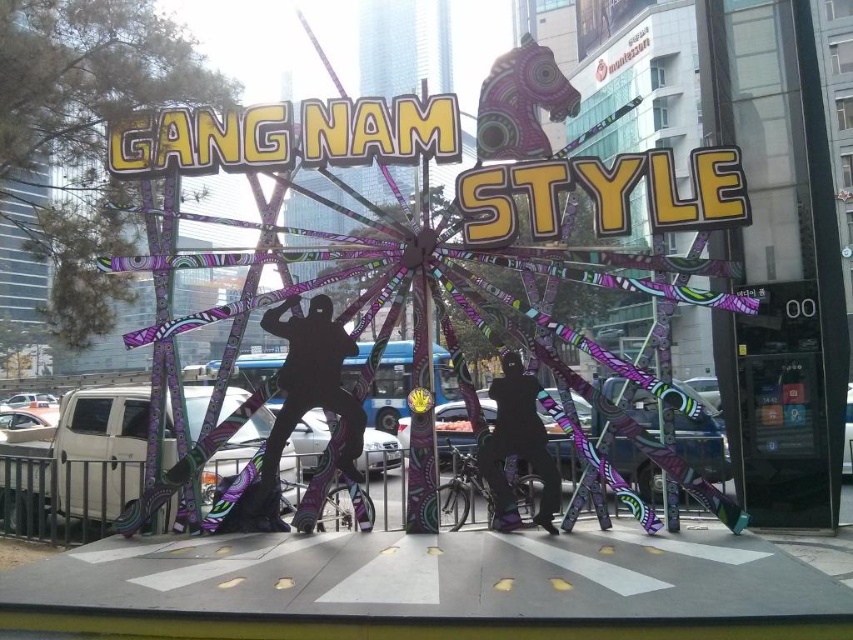
Question: Can you confirm if black matte silhouette at center is positioned to the right of black matte pants at center?

Choices:
 (A) no
 (B) yes

Answer: (A)

Question: Does black matte silhouette at center appear on the left side of black matte pants at center?

Choices:
 (A) no
 (B) yes

Answer: (B)

Question: Which object is closer to the camera taking this photo?

Choices:
 (A) metallic purple ferris wheel at center
 (B) black matte silhouette at center
 (C) black matte pants at center

Answer: (A)

Question: Is black matte silhouette at center closer to the viewer compared to black matte pants at center?

Choices:
 (A) no
 (B) yes

Answer: (A)

Question: Which point is closer to the camera taking this photo?

Choices:
 (A) (480, 460)
 (B) (248, 116)
 (C) (325, 310)

Answer: (A)

Question: Which point appears closest to the camera in this image?

Choices:
 (A) (302, 374)
 (B) (618, 276)
 (C) (502, 429)

Answer: (B)